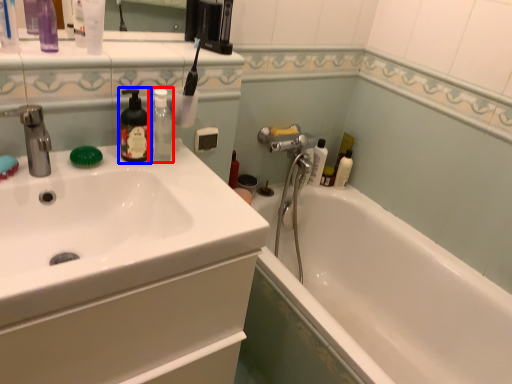
Question: Which of the following is the farthest to the observer, mouthwash (highlighted by a red box) or soap dispenser (highlighted by a blue box)?

Choices:
 (A) mouthwash
 (B) soap dispenser

Answer: (A)